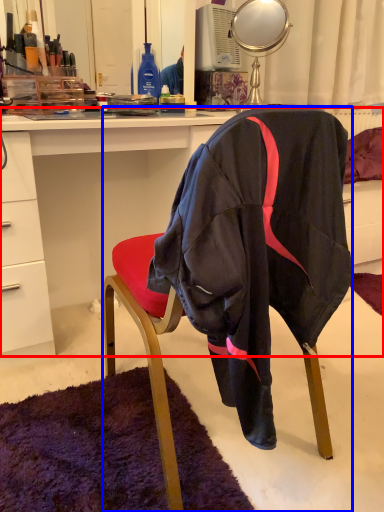
Question: Which object is closer to the camera taking this photo, desk (highlighted by a red box) or chair (highlighted by a blue box)?

Choices:
 (A) desk
 (B) chair

Answer: (B)